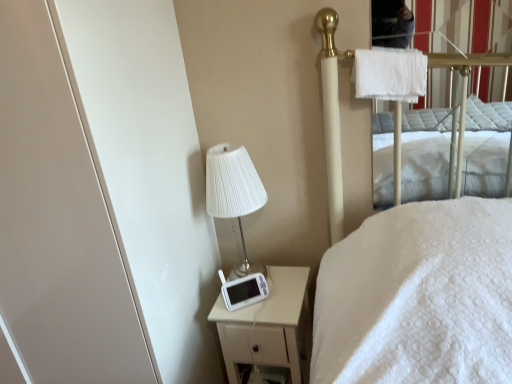
Identify the location of blank space above white matte nightstand at lower right (from a real-world perspective). The height and width of the screenshot is (384, 512). (262, 286).